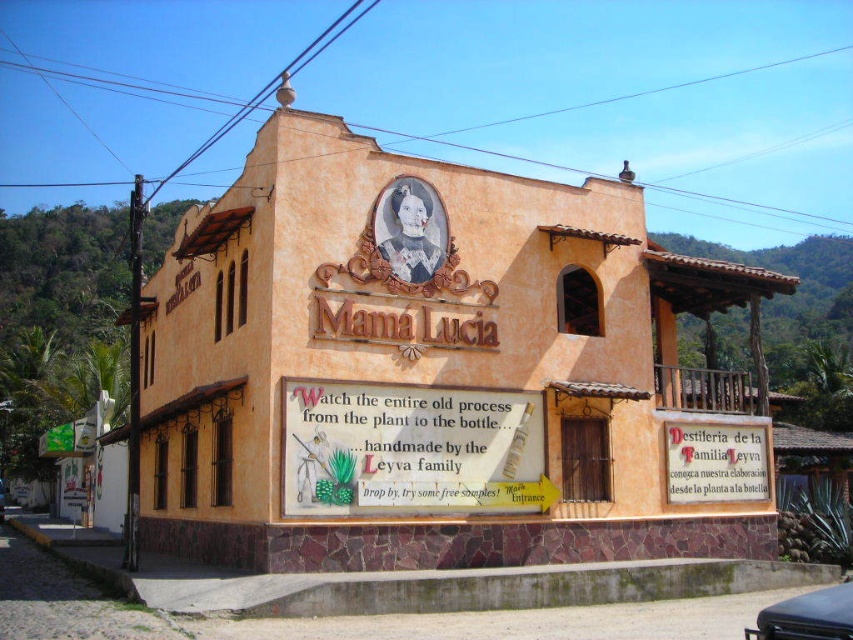
Does white paper sign at center have a lesser height compared to black matte car at lower right?

Yes.

Does point (686, 435) come closer to viewer compared to point (788, 608)?

That is False.

Measure the distance between white paper sign at center and camera.

A distance of 150.79 feet exists between white paper sign at center and camera.

Where is `white paper sign at center`? The image size is (853, 640). white paper sign at center is located at coordinates (717, 461).

Who is more forward, [781,620] or [4,509]?

Point [781,620] is more forward.

Who is more distant from viewer, (788,602) or (3,483)?

Positioned behind is point (3,483).

Where is `black matte car at lower right`? The height and width of the screenshot is (640, 853). black matte car at lower right is located at coordinates (807, 616).

At what (x,y) coordinates should I click in order to perform the action: click on wooden signboard at center. Please return your answer as a coordinate pair (x, y). This screenshot has width=853, height=640. Looking at the image, I should click on (410, 449).

Does wooden signboard at center appear on the right side of metallic silver car at center?

Indeed, wooden signboard at center is positioned on the right side of metallic silver car at center.

Which is in front, point (418, 477) or point (0, 483)?

Positioned in front is point (418, 477).

The image size is (853, 640). Find the location of `wooden signboard at center`. wooden signboard at center is located at coordinates (410, 449).